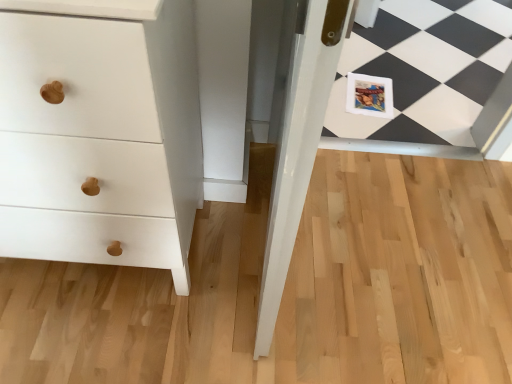
Question: Considering the positions of point (45, 119) and point (362, 84), is point (45, 119) closer or farther from the camera than point (362, 84)?

Choices:
 (A) closer
 (B) farther

Answer: (A)

Question: Would you say white matte wood chest of drawers at left is inside or outside matte paper postcard at center?

Choices:
 (A) outside
 (B) inside

Answer: (A)

Question: In terms of height, does white matte wood chest of drawers at left look taller or shorter compared to matte paper postcard at center?

Choices:
 (A) tall
 (B) short

Answer: (A)

Question: Does point (374, 82) appear closer or farther from the camera than point (122, 91)?

Choices:
 (A) closer
 (B) farther

Answer: (B)

Question: Considering the positions of matte paper postcard at center and white matte wood chest of drawers at left in the image, is matte paper postcard at center taller or shorter than white matte wood chest of drawers at left?

Choices:
 (A) tall
 (B) short

Answer: (B)

Question: Is matte paper postcard at center wider or thinner than white matte wood chest of drawers at left?

Choices:
 (A) wide
 (B) thin

Answer: (B)

Question: In the image, is matte paper postcard at center positioned in front of or behind white matte wood chest of drawers at left?

Choices:
 (A) behind
 (B) front

Answer: (A)